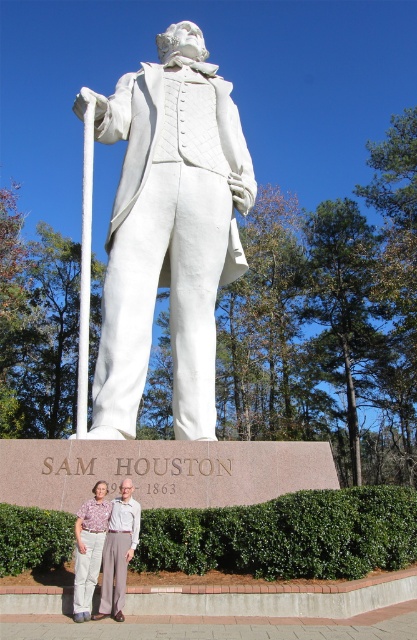
You are a photographer trying to capture a photo of the white marble statue at center and the light brown fabric pants at lower center. Which object should you focus on first if you want to ensure both are in focus without adjusting the camera settings?

The white marble statue at center is taller than the light brown fabric pants at lower center, so you should focus on the white marble statue at center first since it is farther away. This will ensure the pants at lower center are also in focus due to the depth of field extending from the statue to the pants.

You are a photographer taking a picture of the statue and the people. You want to ensure that both the white marble statue at center and the light brown fabric pants at lower center are clearly visible in the frame. Based on their positions, which object should you focus on first to ensure both are in focus?

The white marble statue at center is to the left of light brown fabric pants at lower center, so focusing on the statue first will help ensure both are in focus as they are positioned side by side.

You are a photographer standing at the camera position. You want to take a photo of the white marble statue at center. Is the statue within the camera lens range of 25 meters? Please explain your answer.

The white marble statue at center and camera are 27.30 meters apart. Since the camera lens range is 25 meters, the statue is beyond the maximum distance the camera can capture clearly. Therefore, the statue is outside the camera lens range.